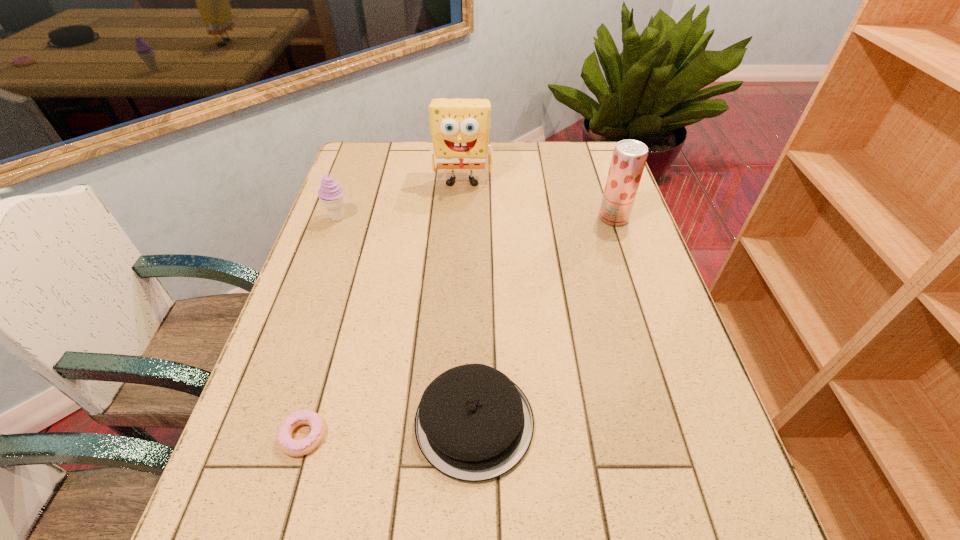
Locate an element on the screen. The height and width of the screenshot is (540, 960). free space at the far left corner of the desktop is located at coordinates (383, 162).

Identify the location of vacant region at the far right corner of the desktop. (582, 170).

Where is `empty space that is in between the pancake and the rightmost object`? The width and height of the screenshot is (960, 540). empty space that is in between the pancake and the rightmost object is located at coordinates (544, 320).

This screenshot has height=540, width=960. What are the coordinates of `vacant space that is in between the sponge and the leftmost object` in the screenshot? It's located at (400, 199).

This screenshot has height=540, width=960. Identify the location of free space between the second object from left to right and the rightmost object. (458, 327).

Identify the location of blank region between the third tallest object and the rightmost object. The image size is (960, 540). (476, 218).

The image size is (960, 540). I want to click on free space between the farthest object and the icecream, so pyautogui.click(x=400, y=199).

Locate an element on the screen. This screenshot has height=540, width=960. free space between the farthest object and the leftmost object is located at coordinates (400, 199).

I want to click on vacant area between the fruit juice and the farthest object, so click(x=538, y=199).

Image resolution: width=960 pixels, height=540 pixels. Identify the location of vacant point located between the farthest object and the shortest object. (383, 308).